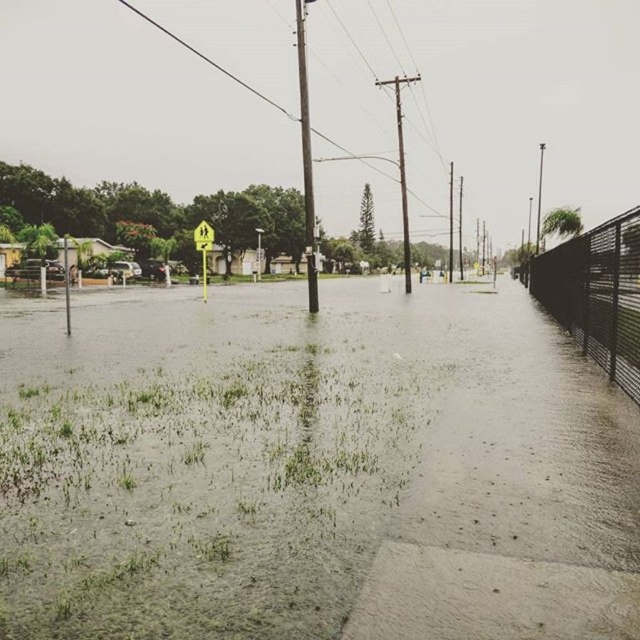
Who is taller, black metal fence at right or yellow plastic sign at center?

Standing taller between the two is black metal fence at right.

This screenshot has height=640, width=640. What do you see at coordinates (595, 294) in the screenshot? I see `black metal fence at right` at bounding box center [595, 294].

Between point (538, 266) and point (202, 253), which one is positioned behind?

The point (202, 253) is more distant.

In order to click on black metal fence at right in this screenshot , I will do `click(595, 294)`.

Does muddy water at center have a greater height compared to yellow plastic sign at center?

No, muddy water at center is not taller than yellow plastic sign at center.

Based on the photo, which is above, muddy water at center or yellow plastic sign at center?

yellow plastic sign at center is above.

Who is more forward, (630, 476) or (205, 266)?

Point (630, 476)

At what (x,y) coordinates should I click in order to perform the action: click on muddy water at center. Please return your answer as a coordinate pair (x, y). The width and height of the screenshot is (640, 640). Looking at the image, I should click on (310, 468).

Is muddy water at center behind black metal fence at right?

No.

Can you confirm if muddy water at center is shorter than black metal fence at right?

Yes, muddy water at center is shorter than black metal fence at right.

This screenshot has width=640, height=640. What do you see at coordinates (310, 468) in the screenshot?
I see `muddy water at center` at bounding box center [310, 468].

Locate an element on the screen. muddy water at center is located at coordinates (310, 468).